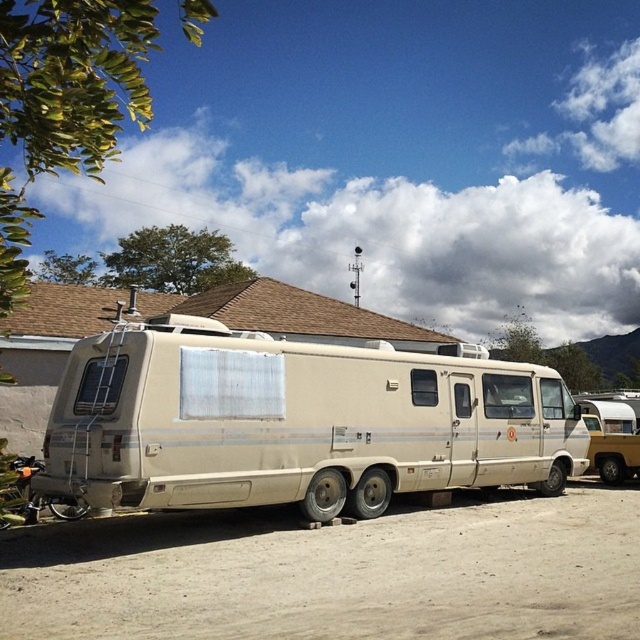
You are standing at the origin point of the coordinate system. Where is the beige matte van at center located?

The beige matte van at center is located at point [296,420].

You are standing on the dirt sand at lower center and want to board the beige matte van at center. Which direction should you walk to reach the van?

The beige matte van at center is positioned on the left side of dirt sand at lower center, so you should walk to the left to reach the van.

In the scene shown: You are standing in front of the beige matte van at center and want to walk towards the dirt sand at lower center. In which direction should you move relative to the van?

The dirt sand at lower center is behind the beige matte van at center, so you should move backward away from the van to reach the dirt sand at lower center.